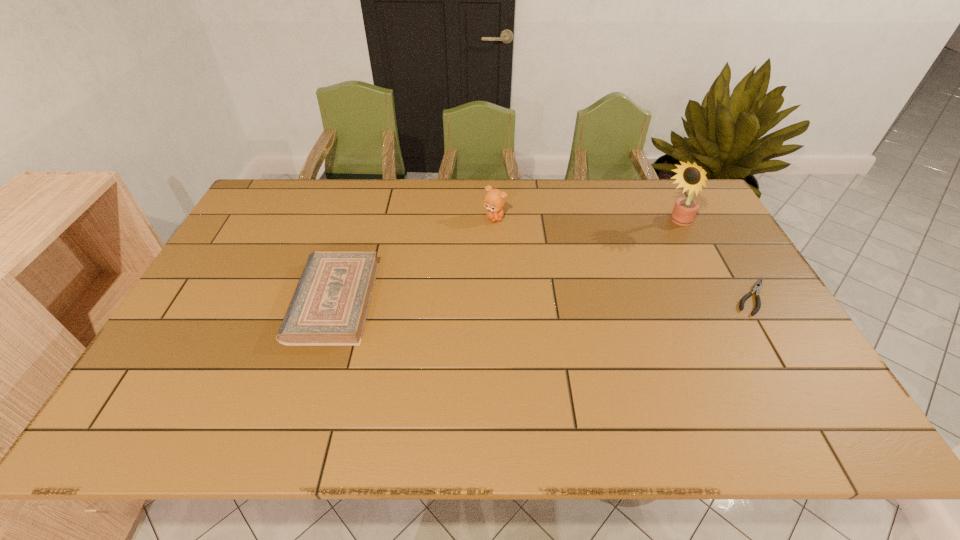
Identify the location of vacant spot on the desktop that is between the leftmost object and the shortest object and is positioned on the face of the sunflower. (569, 299).

Locate an element on the screen. The width and height of the screenshot is (960, 540). free space on the desktop that is between the leftmost object and the pliers and is positioned on the face of the second tallest object is located at coordinates (535, 299).